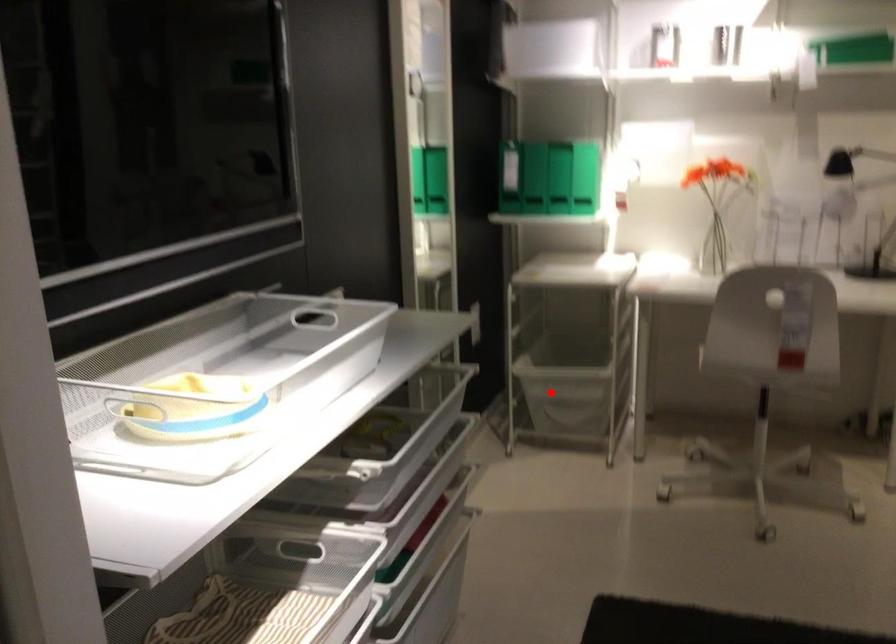
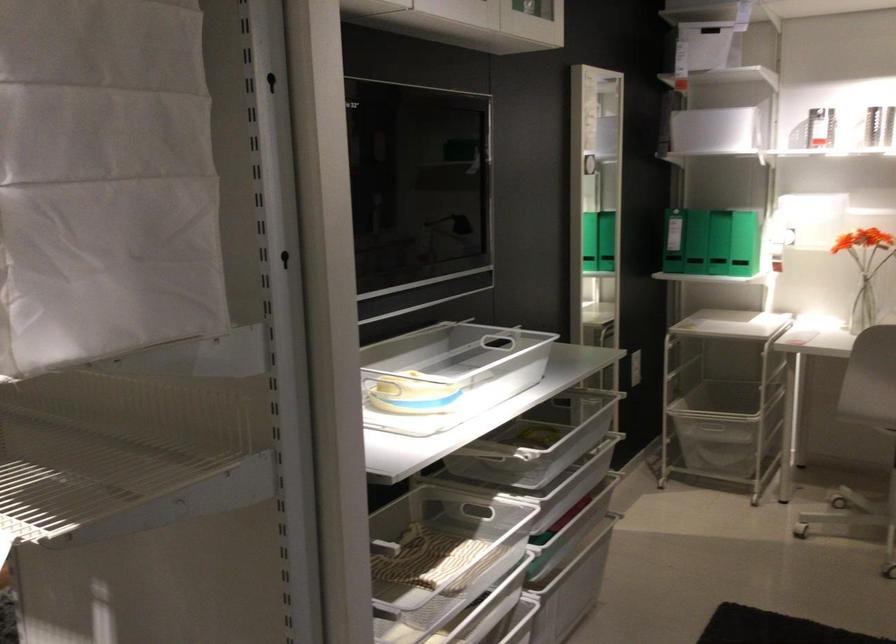
Find the pixel in the second image that matches the highlighted location in the first image.

(712, 430)